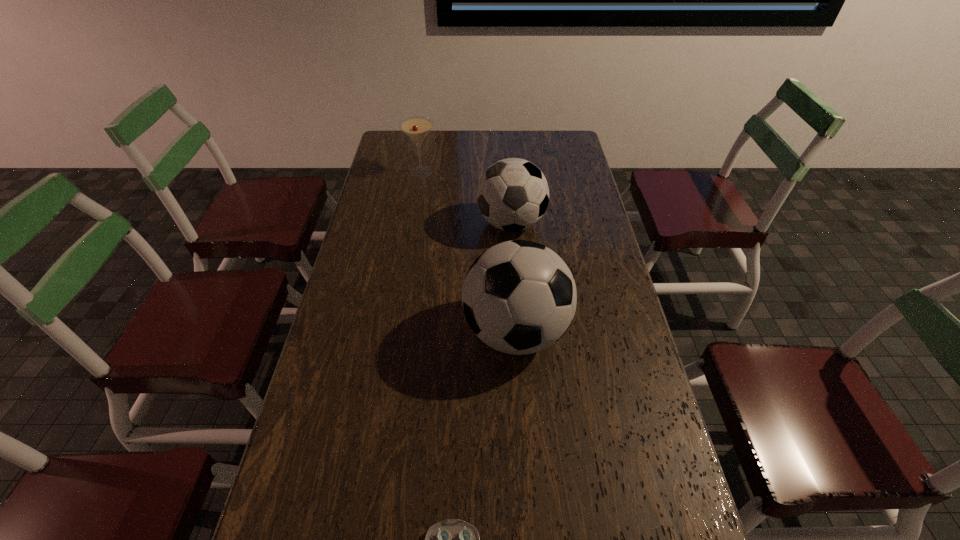
The height and width of the screenshot is (540, 960). In order to click on the nearer soccer ball in this screenshot , I will do `click(519, 297)`.

Where is `the taller soccer ball`? This screenshot has width=960, height=540. the taller soccer ball is located at coordinates (519, 297).

You are a GUI agent. You are given a task and a screenshot of the screen. Output one action in this format:
    pyautogui.click(x=<x>, y=<y>)
    Task: Click on the farther soccer ball
    This screenshot has height=540, width=960.
    Given the screenshot: What is the action you would take?
    pyautogui.click(x=512, y=194)

The width and height of the screenshot is (960, 540). Find the location of `the second farthest object`. the second farthest object is located at coordinates (512, 194).

I want to click on martini, so click(416, 128).

At what (x,y) coordinates should I click in order to perform the action: click on the farthest object. Please return your answer as a coordinate pair (x, y). Looking at the image, I should click on (416, 128).

The width and height of the screenshot is (960, 540). Find the location of `free space located on the left of the tallest object`. free space located on the left of the tallest object is located at coordinates (383, 332).

The image size is (960, 540). Find the location of `free point located 0.190m on the main logo of the third nearest object`. free point located 0.190m on the main logo of the third nearest object is located at coordinates (424, 224).

I want to click on free space located on the main logo of the third nearest object, so click(x=441, y=224).

You are a GUI agent. You are given a task and a screenshot of the screen. Output one action in this format:
    pyautogui.click(x=<x>, y=<y>)
    Task: Click on the vacant region located on the main logo of the third nearest object
    The image size is (960, 540).
    Given the screenshot: What is the action you would take?
    pyautogui.click(x=372, y=224)